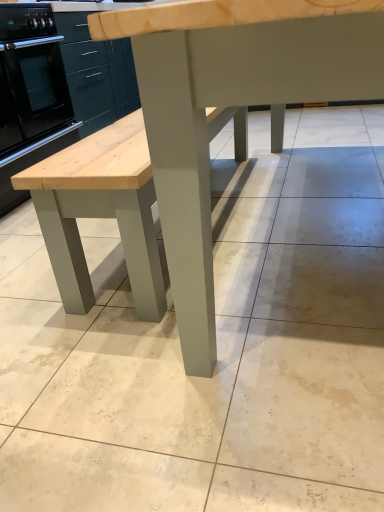
Question: Looking at the image, does matte gray table at center seem bigger or smaller compared to black glossy oven at left?

Choices:
 (A) big
 (B) small

Answer: (A)

Question: Is point pos(183,132) closer or farther from the camera than point pos(38,156)?

Choices:
 (A) farther
 (B) closer

Answer: (B)

Question: Visually, is matte gray table at center positioned to the left or to the right of black glossy oven at left?

Choices:
 (A) left
 (B) right

Answer: (B)

Question: Based on their sizes in the image, would you say black glossy oven at left is bigger or smaller than matte gray table at center?

Choices:
 (A) small
 (B) big

Answer: (A)

Question: Considering the positions of point (26, 125) and point (201, 17), is point (26, 125) closer or farther from the camera than point (201, 17)?

Choices:
 (A) farther
 (B) closer

Answer: (A)

Question: In the image, is black glossy oven at left positioned in front of or behind matte gray table at center?

Choices:
 (A) front
 (B) behind

Answer: (B)

Question: Considering the relative positions of black glossy oven at left and matte gray table at center in the image provided, is black glossy oven at left to the left or to the right of matte gray table at center?

Choices:
 (A) left
 (B) right

Answer: (A)